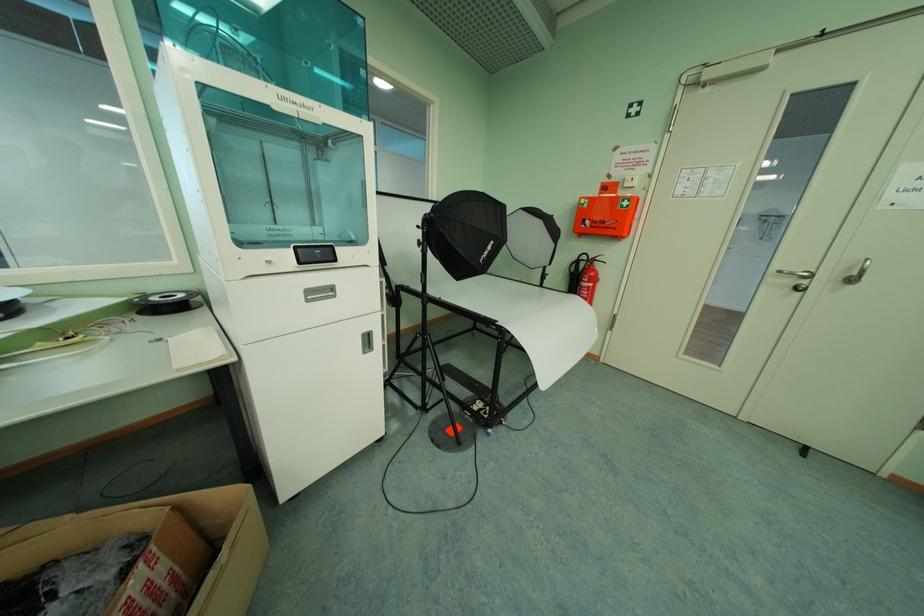
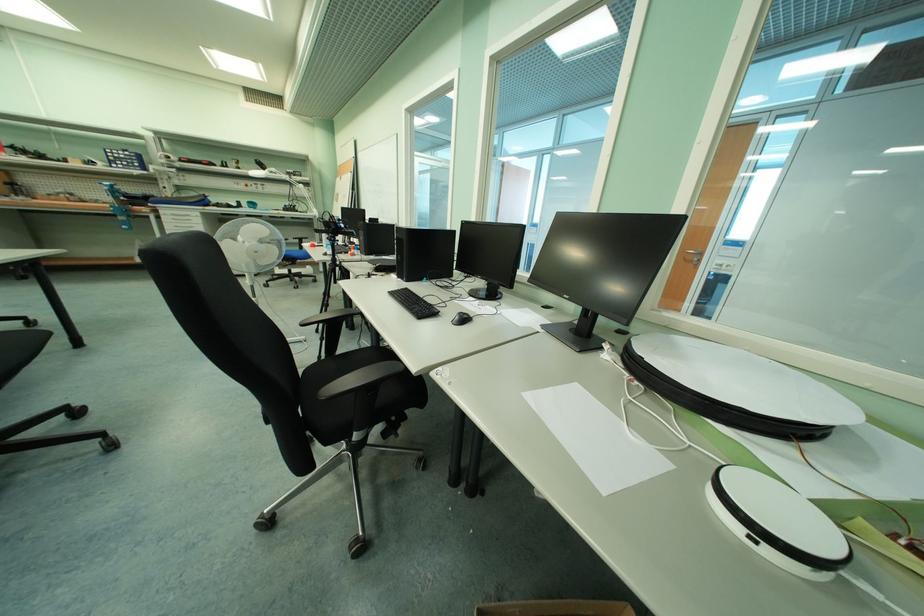
How did the camera likely rotate?

The rotation direction of the camera is left-down.